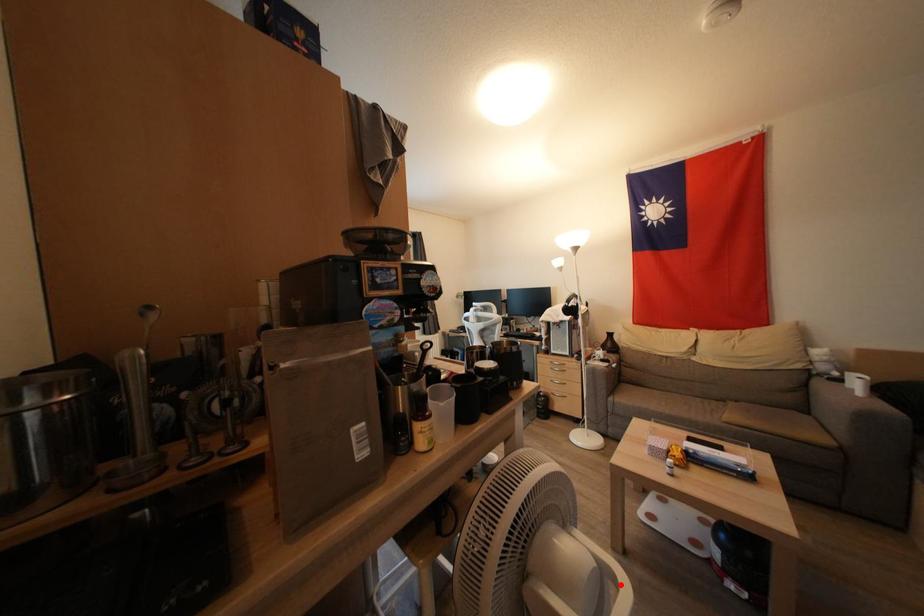
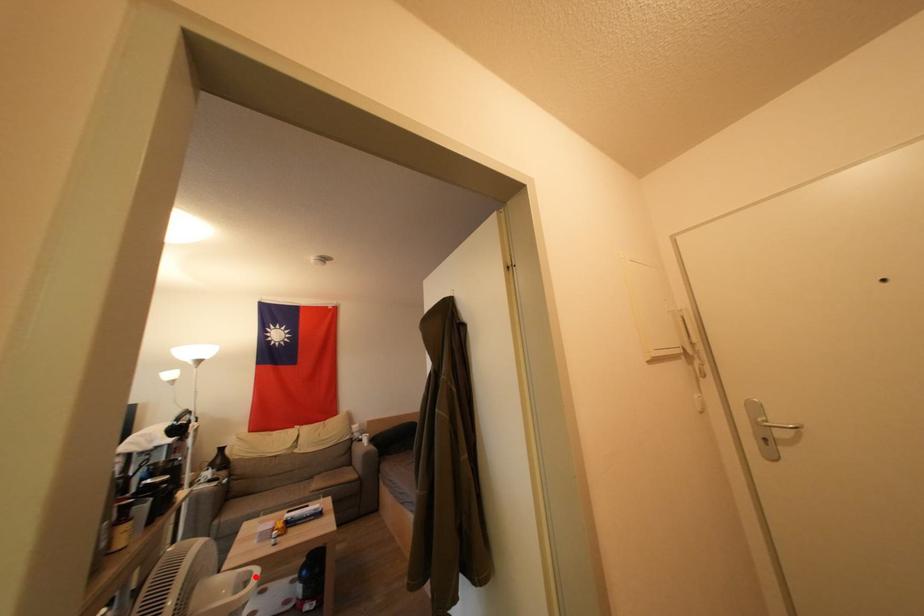
I am providing you with two images of the same scene from different viewpoints. A red point is marked on the first image and another point is marked on the second image. Are the points marked in image1 and image2 representing the same 3D position?

Yes